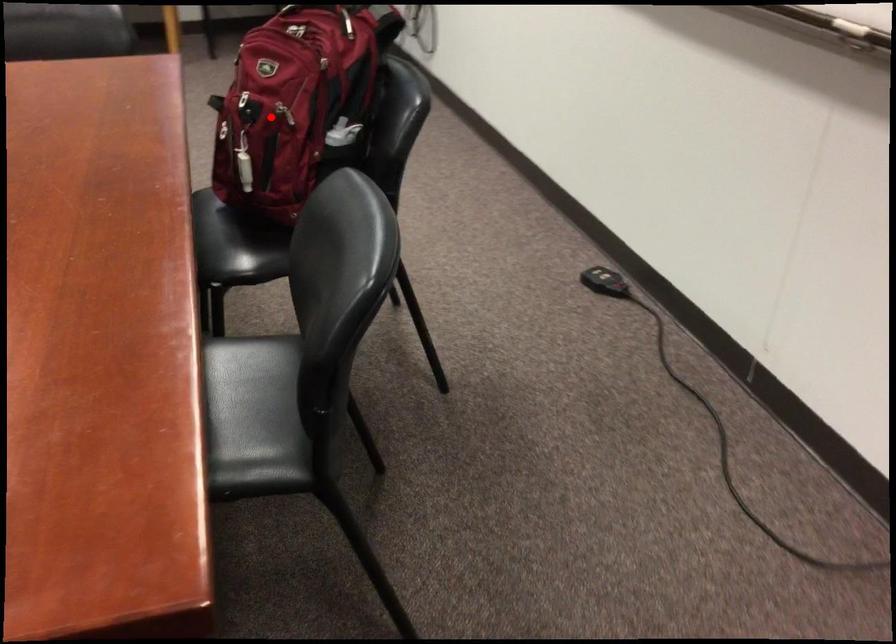
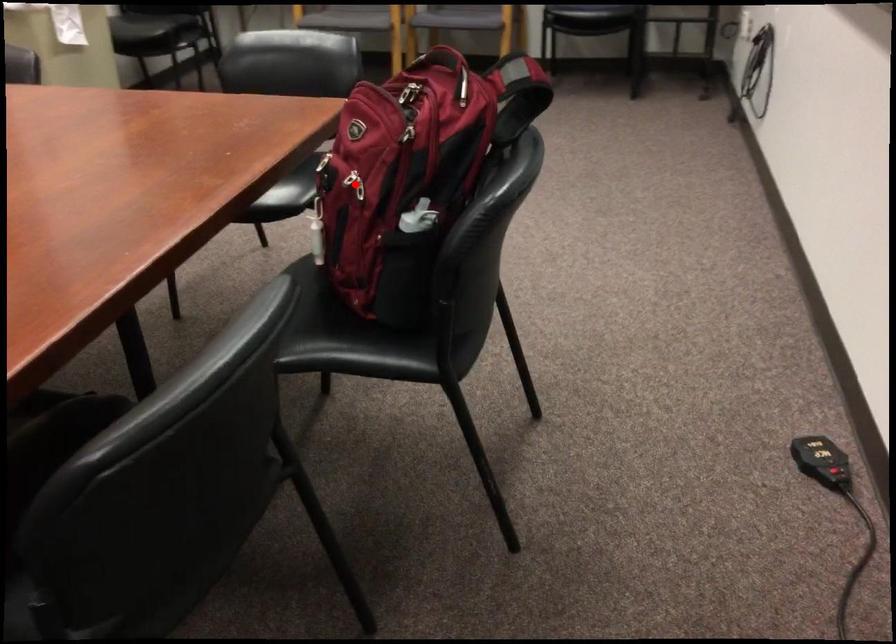
From the picture: I am providing you with two images of the same scene from different viewpoints. A red point is marked on the first image and another point is marked on the second image. Are the points marked in image1 and image2 representing the same 3D position?

Yes